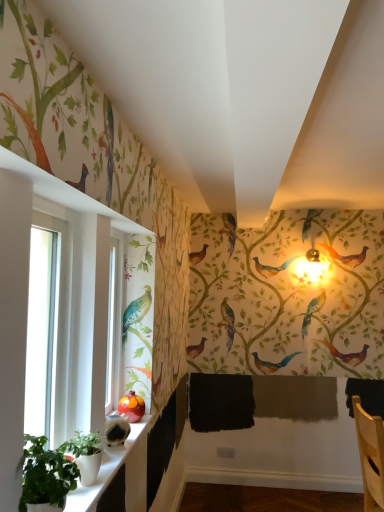
Question: Is clear glass window at left oriented towards green matte plant at lower left, acting as the second plant starting from the front?

Choices:
 (A) yes
 (B) no

Answer: (A)

Question: Is green matte plant at lower left, positioned as the 1th plant in back-to-front order, completely or partially inside clear glass window at left?

Choices:
 (A) yes
 (B) no

Answer: (B)

Question: Does clear glass window at left have a larger size compared to green matte plant at lower left, positioned as the 1th plant in back-to-front order?

Choices:
 (A) yes
 (B) no

Answer: (A)

Question: Is clear glass window at left thinner than green matte plant at lower left, positioned as the 1th plant in back-to-front order?

Choices:
 (A) no
 (B) yes

Answer: (A)

Question: Is clear glass window at left located outside green matte plant at lower left, acting as the second plant starting from the front?

Choices:
 (A) no
 (B) yes

Answer: (B)

Question: From a real-world perspective, is green matte plant at lower left, positioned as the 1th plant in back-to-front order, above or below green matte plant at lower left, acting as the 1th plant starting from the front?

Choices:
 (A) below
 (B) above

Answer: (A)

Question: Choose the correct answer: Is green matte plant at lower left, acting as the second plant starting from the front, inside green matte plant at lower left, acting as the 1th plant starting from the front, or outside it?

Choices:
 (A) outside
 (B) inside

Answer: (A)

Question: From the image's perspective, is green matte plant at lower left, acting as the second plant starting from the front, above or below green matte plant at lower left, acting as the 1th plant starting from the front?

Choices:
 (A) above
 (B) below

Answer: (B)

Question: From their relative heights in the image, would you say green matte plant at lower left, acting as the second plant starting from the front, is taller or shorter than green matte plant at lower left, which is the 2th plant from back to front?

Choices:
 (A) tall
 (B) short

Answer: (B)

Question: Considering the relative positions of clear glass window at left and green matte plant at lower left, which is the 2th plant from back to front, in the image provided, is clear glass window at left to the left or to the right of green matte plant at lower left, which is the 2th plant from back to front,?

Choices:
 (A) left
 (B) right

Answer: (A)

Question: From their relative heights in the image, would you say clear glass window at left is taller or shorter than green matte plant at lower left, which is the 2th plant from back to front?

Choices:
 (A) short
 (B) tall

Answer: (B)

Question: Is clear glass window at left in front of or behind green matte plant at lower left, which is the 2th plant from back to front, in the image?

Choices:
 (A) front
 (B) behind

Answer: (B)

Question: Is clear glass window at left inside or outside of green matte plant at lower left, which is the 2th plant from back to front?

Choices:
 (A) inside
 (B) outside

Answer: (B)

Question: Is white ceramic window sill at lower left inside or outside of clear glass window at left?

Choices:
 (A) outside
 (B) inside

Answer: (A)

Question: From the image's perspective, is white ceramic window sill at lower left located above or below clear glass window at left?

Choices:
 (A) below
 (B) above

Answer: (A)